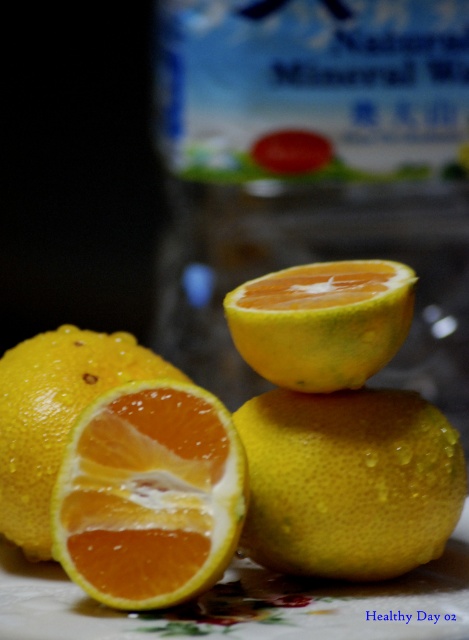
Which is more to the left, spongy yellow grapefruit at center or glossy yellow orange at center?

spongy yellow grapefruit at center

Find the location of a particular element. This screenshot has height=640, width=469. spongy yellow grapefruit at center is located at coordinates (232, 448).

Who is higher up, glossy yellow orange at center or smooth yellow grapefruit at lower left?

smooth yellow grapefruit at lower left is higher up.

Based on the photo, does glossy yellow orange at center have a smaller size compared to smooth yellow grapefruit at lower left?

Correct, glossy yellow orange at center occupies less space than smooth yellow grapefruit at lower left.

The width and height of the screenshot is (469, 640). What do you see at coordinates (348, 481) in the screenshot?
I see `glossy yellow orange at center` at bounding box center [348, 481].

Find the location of a particular element. This screenshot has width=469, height=640. glossy yellow orange at center is located at coordinates (348, 481).

Is spongy yellow grapefruit at center in front of yellow matte orange at center?

Yes, it is.

Between point (390, 440) and point (413, 269), which one is positioned in front?

Point (390, 440)

Identify the location of spongy yellow grapefruit at center. The image size is (469, 640). (232, 448).